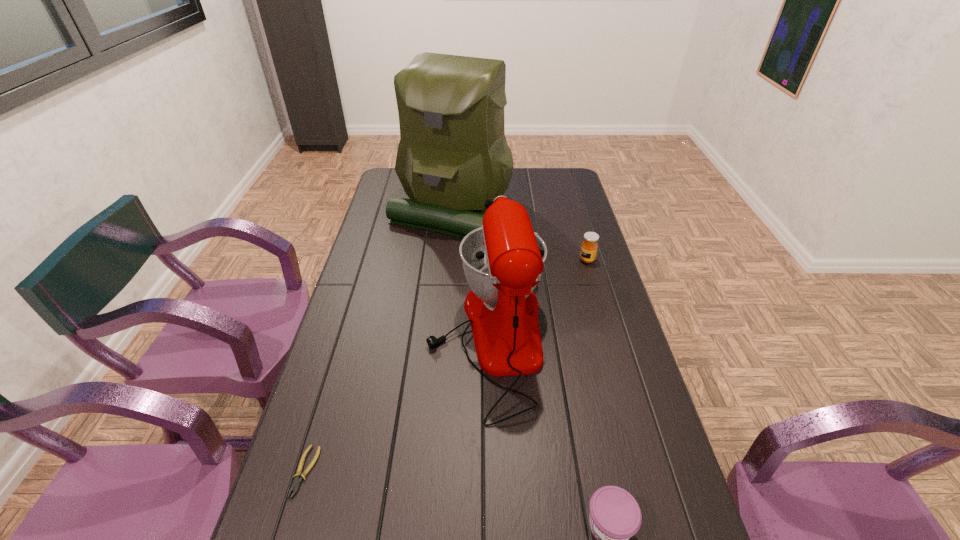
I want to click on object at the far left corner, so click(453, 155).

Where is `vacant region at the left edge of the desktop`? vacant region at the left edge of the desktop is located at coordinates (364, 385).

Where is `vacant space at the right edge of the desktop`? This screenshot has width=960, height=540. vacant space at the right edge of the desktop is located at coordinates (581, 224).

Where is `free spot at the far left corner of the desktop`? free spot at the far left corner of the desktop is located at coordinates (397, 176).

Find the location of `free space between the backpack and the shortest object`. free space between the backpack and the shortest object is located at coordinates click(378, 341).

Locate an element on the screen. This screenshot has height=540, width=960. unoccupied area between the backpack and the shortest object is located at coordinates (378, 341).

Identify which object is the closest to the honey. Please provide its 2D coordinates. Your answer should be formatted as a tuple, i.e. [(x, y)], where the tuple contains the x and y coordinates of a point satisfying the conditions above.

[(503, 260)]

I want to click on object that stands as the second closest to the second shortest object, so click(x=296, y=484).